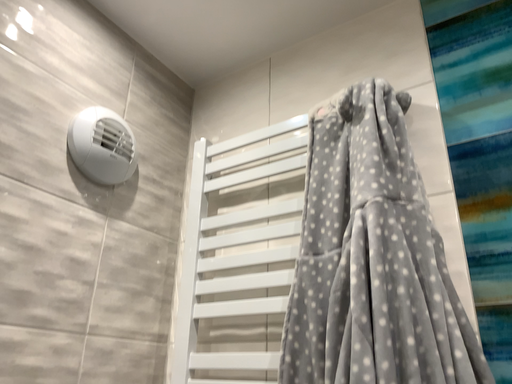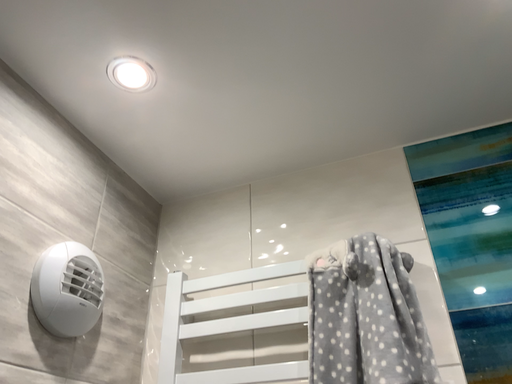
Question: Which way did the camera rotate in the video?

Choices:
 (A) rotated left
 (B) rotated right

Answer: (B)